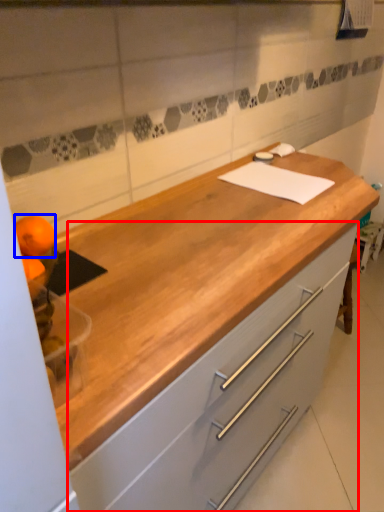
Question: Which point is further to the camera, cabinetry (highlighted by a red box) or orange (highlighted by a blue box)?

Choices:
 (A) cabinetry
 (B) orange

Answer: (A)